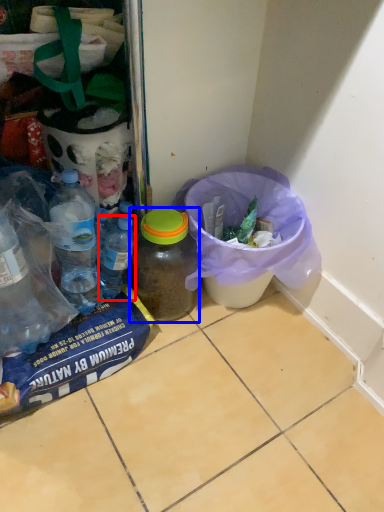
Question: Which of the following is the closest to the observer, bottle (highlighted by a red box) or bottle (highlighted by a blue box)?

Choices:
 (A) bottle
 (B) bottle

Answer: (B)